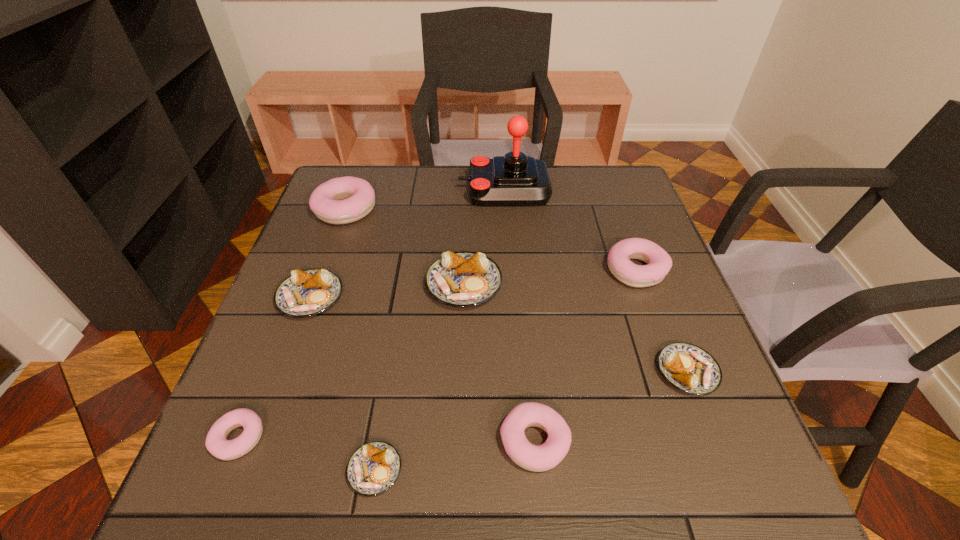
Image resolution: width=960 pixels, height=540 pixels. What are the coordinates of `the fourth closest brown pastry relative to the joystick` in the screenshot? It's located at (373, 468).

The width and height of the screenshot is (960, 540). Find the location of `free region that satisfies the following two spatial constraints: 1. on the front side of the second smallest pink pastry; 2. on the left side of the smallest pink pastry`. free region that satisfies the following two spatial constraints: 1. on the front side of the second smallest pink pastry; 2. on the left side of the smallest pink pastry is located at coordinates (237, 441).

Where is `vacant position in the image that satisfies the following two spatial constraints: 1. on the base of the third smallest pink pastry; 2. on the right side of the joystick`? vacant position in the image that satisfies the following two spatial constraints: 1. on the base of the third smallest pink pastry; 2. on the right side of the joystick is located at coordinates (510, 269).

Where is `vacant position in the image that satisfies the following two spatial constraints: 1. on the base of the third pink pastry from left to right; 2. on the left side of the tallest object`? vacant position in the image that satisfies the following two spatial constraints: 1. on the base of the third pink pastry from left to right; 2. on the left side of the tallest object is located at coordinates (521, 441).